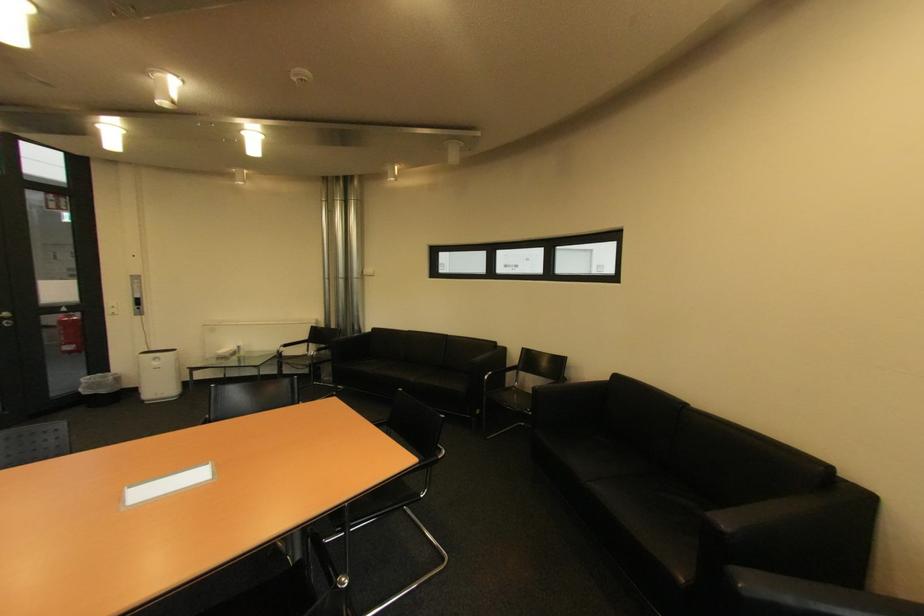
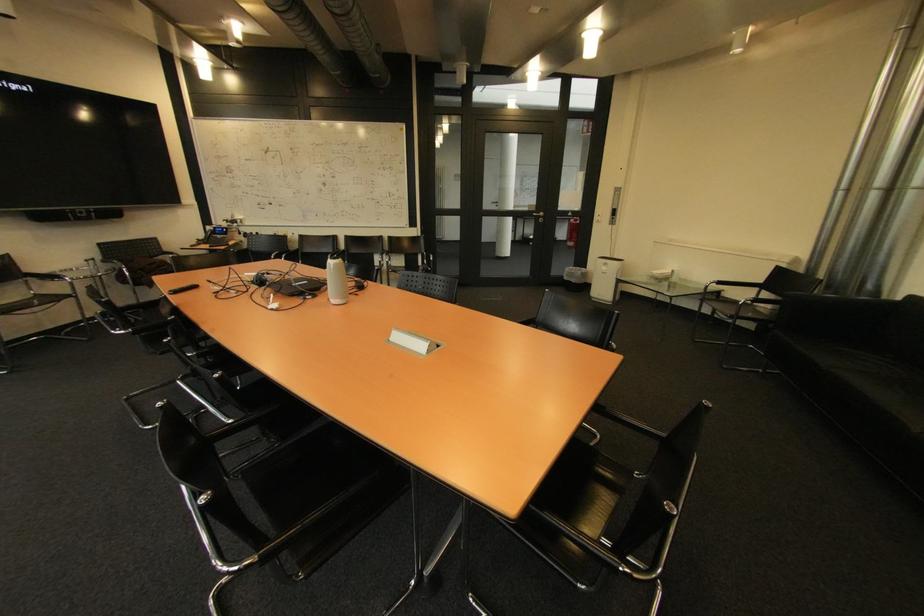
Where in the second image is the point corresponding to (371,333) from the first image?

(893, 300)